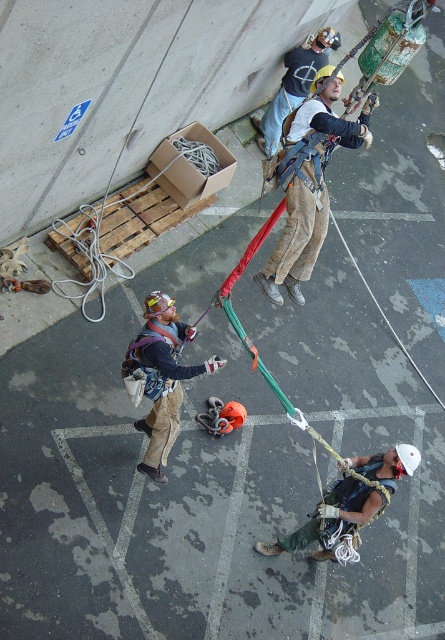
Is the position of rope-wrapped helmet at center more distant than that of matte black harness at center?

No, it is in front of matte black harness at center.

The image size is (445, 640). What do you see at coordinates (348, 506) in the screenshot?
I see `rope-wrapped helmet at center` at bounding box center [348, 506].

Image resolution: width=445 pixels, height=640 pixels. What do you see at coordinates (348, 506) in the screenshot?
I see `rope-wrapped helmet at center` at bounding box center [348, 506].

Image resolution: width=445 pixels, height=640 pixels. Identify the location of rope-wrapped helmet at center. (348, 506).

Does point (288, 193) lie behind point (149, 417)?

Yes, it is behind point (149, 417).

Between point (262, 285) and point (157, 401), which one is positioned behind?

Point (262, 285)

Does point (307, 100) lie in front of point (169, 413)?

No, (307, 100) is further to viewer.

The width and height of the screenshot is (445, 640). I want to click on matte black harness at upper center, so click(308, 184).

Which is above, matte black harness at upper center or rope-wrapped helmet at center?

matte black harness at upper center is higher up.

Can you confirm if matte black harness at upper center is smaller than rope-wrapped helmet at center?

No.

Is point (356, 131) closer to viewer compared to point (339, 500)?

No, (356, 131) is behind (339, 500).

Find the location of a particular element. The image size is (445, 640). matte black harness at upper center is located at coordinates (308, 184).